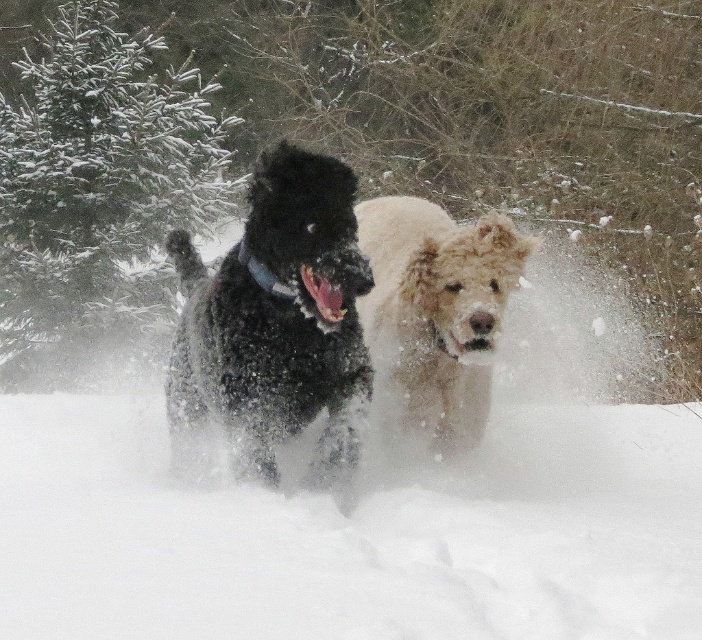
You are a photographer trying to capture the two dogs in the snowy landscape. You want to ensure that both the white fluffy snow at center and the fuzzy beige dog at center are clearly visible in your shot. Given their sizes, which one should you focus on to ensure proper exposure?

The white fluffy snow at center is bigger than the fuzzy beige dog at center, so focusing on the snow might help balance the exposure since it occupies more of the frame.

You are a drone operator trying to capture a photo of the two dogs running in the snowy landscape. The green textured pine at upper left is part of the background. Where should you position the drone to ensure the pine tree is in the upper left corner of the photo?

Position the drone so that the green textured pine at upper left is located at the coordinates point (98, 189) to ensure it appears in the upper left corner of the photo.